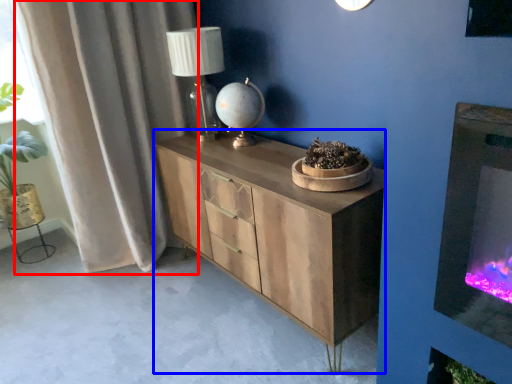
Question: Which object appears closest to the camera in this image, curtain (highlighted by a red box) or chest of drawers (highlighted by a blue box)?

Choices:
 (A) curtain
 (B) chest of drawers

Answer: (B)